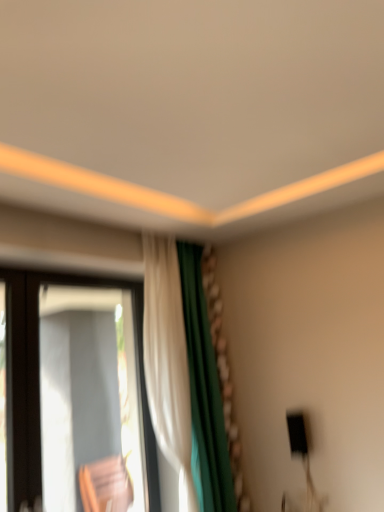
In order to click on white fabric curtain at center in this screenshot , I will do `click(168, 362)`.

The image size is (384, 512). Describe the element at coordinates (168, 362) in the screenshot. I see `white fabric curtain at center` at that location.

This screenshot has width=384, height=512. What do you see at coordinates (39, 380) in the screenshot? I see `transparent glass window at left` at bounding box center [39, 380].

Measure the distance between transparent glass window at left and camera.

transparent glass window at left and camera are 6.45 feet apart from each other.

The image size is (384, 512). Find the location of `transparent glass window at left`. transparent glass window at left is located at coordinates (39, 380).

Identify the location of white fabric curtain at center. (168, 362).

Is transparent glass window at left to the left or to the right of white fabric curtain at center in the image?

From the image, it's evident that transparent glass window at left is to the left of white fabric curtain at center.

Is transparent glass window at left closer to the viewer compared to white fabric curtain at center?

Yes.

Consider the image. Which point is more distant from viewer, (21, 456) or (180, 420)?

Positioned behind is point (180, 420).

From the picture: From the image's perspective, is transparent glass window at left located above or below white fabric curtain at center?

Clearly, from the image's perspective, transparent glass window at left is below white fabric curtain at center.

From a real-world perspective, does transparent glass window at left stand above white fabric curtain at center?

Incorrect, from a real-world perspective, transparent glass window at left is lower than white fabric curtain at center.

Between transparent glass window at left and white fabric curtain at center, which one has smaller width?

With smaller width is transparent glass window at left.

Can you confirm if transparent glass window at left is shorter than white fabric curtain at center?

Indeed, transparent glass window at left has a lesser height compared to white fabric curtain at center.

Considering the sizes of objects transparent glass window at left and white fabric curtain at center in the image provided, who is smaller, transparent glass window at left or white fabric curtain at center?

With smaller size is transparent glass window at left.

Which is correct: transparent glass window at left is inside white fabric curtain at center, or outside of it?

transparent glass window at left cannot be found inside white fabric curtain at center.

Is transparent glass window at left directly adjacent to white fabric curtain at center?

transparent glass window at left is not next to white fabric curtain at center, and they're not touching.

Is white fabric curtain at center at the back of transparent glass window at left?

No, transparent glass window at left is not facing the opposite direction of white fabric curtain at center.

In the scene shown: How different are the orientations of transparent glass window at left and white fabric curtain at center in degrees?

The angle between the facing direction of transparent glass window at left and the facing direction of white fabric curtain at center is 2.28 degrees.

The height and width of the screenshot is (512, 384). In the image, there is a transparent glass window at left. In order to click on curtain above it (from the image's perspective) in this screenshot , I will do click(x=168, y=362).

Which is more to the right, white fabric curtain at center or transparent glass window at left?

white fabric curtain at center.

Is white fabric curtain at center in front of transparent glass window at left?

No, it is behind transparent glass window at left.

Does point (166, 294) come closer to viewer compared to point (36, 322)?

No, it is behind (36, 322).

From the image's perspective, is white fabric curtain at center below transparent glass window at left?

Incorrect, from the image's perspective, white fabric curtain at center is higher than transparent glass window at left.

From a real-world perspective, relative to transparent glass window at left, is white fabric curtain at center vertically above or below?

white fabric curtain at center is above transparent glass window at left.

Does white fabric curtain at center have a greater width compared to transparent glass window at left?

Yes, white fabric curtain at center is wider than transparent glass window at left.

Based on the photo, does white fabric curtain at center have a greater height compared to transparent glass window at left?

Indeed, white fabric curtain at center has a greater height compared to transparent glass window at left.

From the picture: Considering the relative sizes of white fabric curtain at center and transparent glass window at left in the image provided, is white fabric curtain at center bigger than transparent glass window at left?

Yes.

Is transparent glass window at left completely or partially inside white fabric curtain at center?

No.

Is white fabric curtain at center not near transparent glass window at left?

No, there isn't a large distance between white fabric curtain at center and transparent glass window at left.

Is white fabric curtain at center turned away from transparent glass window at left?

No, white fabric curtain at center's orientation is not away from transparent glass window at left.

Can you tell me how much white fabric curtain at center and transparent glass window at left differ in facing direction?

The angle between the facing direction of white fabric curtain at center and the facing direction of transparent glass window at left is 2.28 degrees.

Locate an element on the screen. The width and height of the screenshot is (384, 512). curtain that appears above the transparent glass window at left (from a real-world perspective) is located at coordinates (168, 362).

In order to click on window below the white fabric curtain at center (from a real-world perspective) in this screenshot , I will do `click(39, 380)`.

This screenshot has width=384, height=512. I want to click on curtain above the transparent glass window at left (from the image's perspective), so point(168,362).